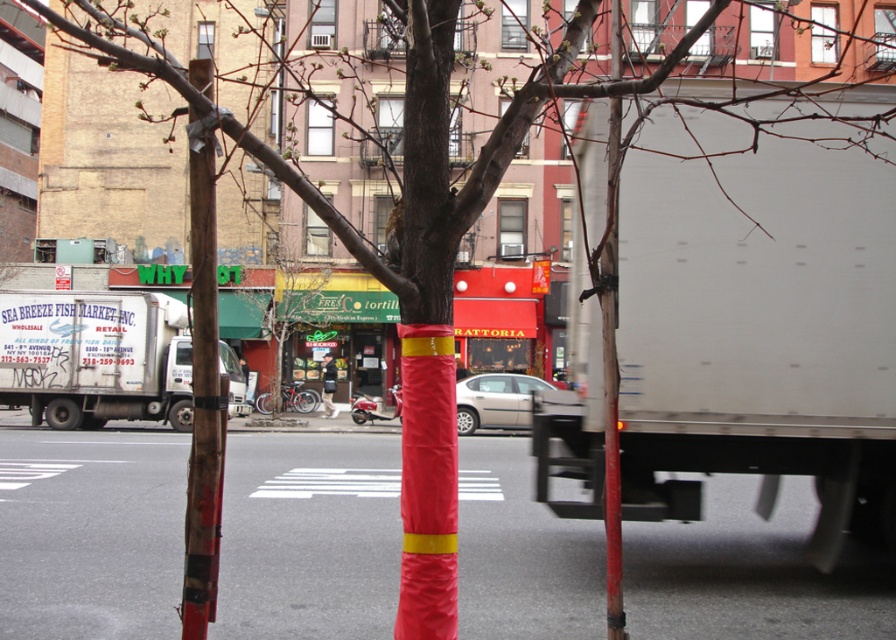
Question: Which object is closer to the camera taking this photo?

Choices:
 (A) white metallic truck at left
 (B) white matte truck at right

Answer: (B)

Question: Which point appears farthest from the camera in this image?

Choices:
 (A) (279, 294)
 (B) (616, 164)

Answer: (A)

Question: Is white metallic truck at left above red plastic pole at center?

Choices:
 (A) yes
 (B) no

Answer: (B)

Question: Is white metallic truck at left smaller than red plastic pole at center?

Choices:
 (A) yes
 (B) no

Answer: (B)

Question: Does white metallic truck at left appear over wooden pole at center?

Choices:
 (A) yes
 (B) no

Answer: (B)

Question: Among these objects, which one is farthest from the camera?

Choices:
 (A) green plastic tree at center
 (B) white matte truck at right
 (C) wooden pole at center
 (D) white metallic truck at left

Answer: (A)